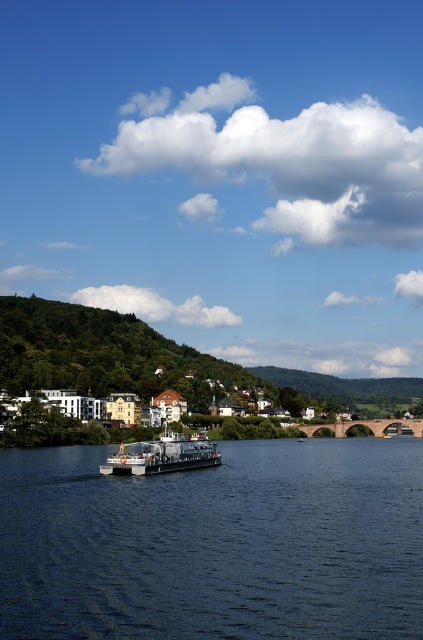
Is point (326, 378) positioned behind point (143, 474)?

Yes, point (326, 378) is farther from viewer.

Is white wooden houses at lower center below metallic gray ferry at center?

Indeed, white wooden houses at lower center is positioned under metallic gray ferry at center.

The height and width of the screenshot is (640, 423). Describe the element at coordinates (41, 422) in the screenshot. I see `white wooden houses at lower center` at that location.

At what (x,y) coordinates should I click in order to perform the action: click on white wooden houses at lower center. Please return your answer as a coordinate pair (x, y). The width and height of the screenshot is (423, 640). Looking at the image, I should click on (41, 422).

The image size is (423, 640). In order to click on dark blue water at center in this screenshot , I will do `click(216, 545)`.

Between dark blue water at center and white wooden houses at lower center, which one is positioned lower?

white wooden houses at lower center

What are the coordinates of `dark blue water at center` in the screenshot? It's located at (216, 545).

Is dark blue water at center shorter than metallic gray ferry at center?

Yes, dark blue water at center is shorter than metallic gray ferry at center.

How far apart are dark blue water at center and metallic gray ferry at center?

dark blue water at center and metallic gray ferry at center are 19.22 meters apart.

This screenshot has height=640, width=423. What do you see at coordinates (216, 545) in the screenshot? I see `dark blue water at center` at bounding box center [216, 545].

The width and height of the screenshot is (423, 640). Find the location of `dark blue water at center`. dark blue water at center is located at coordinates (216, 545).